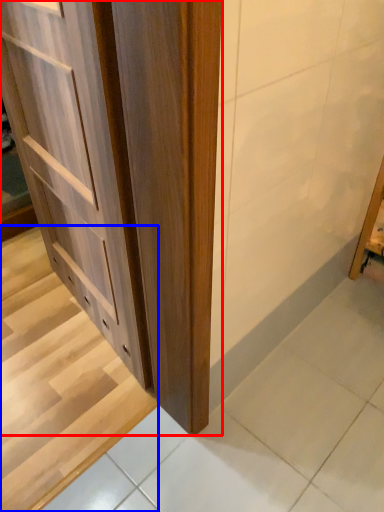
Question: Which object is further to the camera taking this photo, cupboard (highlighted by a red box) or stairwell (highlighted by a blue box)?

Choices:
 (A) cupboard
 (B) stairwell

Answer: (B)